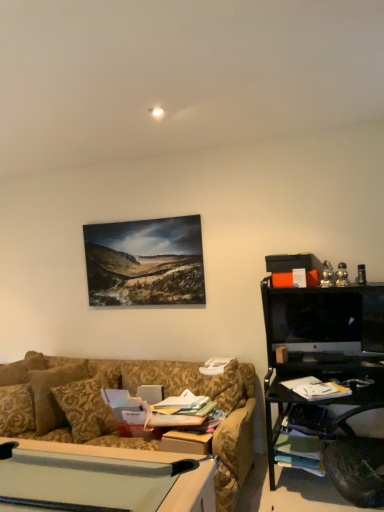
Describe the element at coordinates (88, 406) in the screenshot. This screenshot has width=384, height=512. I see `gold damask pillow at center` at that location.

This screenshot has height=512, width=384. What are the coordinates of `gold damask pillow at center` in the screenshot? It's located at (88, 406).

Identify the location of black glossy monitor at right. This screenshot has width=384, height=512. (317, 322).

The height and width of the screenshot is (512, 384). What do you see at coordinates (317, 322) in the screenshot?
I see `black glossy monitor at right` at bounding box center [317, 322].

Measure the distance between point (299, 296) and camera.

A distance of 3.17 meters exists between point (299, 296) and camera.

Identify the location of gold damask pillow at center. (88, 406).

Consider the image. Considering the relative positions of gold damask pillow at center and black glossy monitor at right in the image provided, is gold damask pillow at center to the left of black glossy monitor at right from the viewer's perspective?

Indeed, gold damask pillow at center is positioned on the left side of black glossy monitor at right.

In the image, is gold damask pillow at center positioned in front of or behind black glossy monitor at right?

Clearly, gold damask pillow at center is in front of black glossy monitor at right.

Considering the points (112, 378) and (289, 341), which point is in front, point (112, 378) or point (289, 341)?

The point (289, 341) is closer.

From the image's perspective, is gold damask pillow at center on black glossy monitor at right?

Actually, gold damask pillow at center appears below black glossy monitor at right in the image.

From a real-world perspective, between gold damask pillow at center and black glossy monitor at right, who is vertically higher?

black glossy monitor at right.

Can you confirm if gold damask pillow at center is wider than black glossy monitor at right?

Yes.

Does gold damask pillow at center have a lesser height compared to black glossy monitor at right?

No.

In terms of size, does gold damask pillow at center appear bigger or smaller than black glossy monitor at right?

Considering their sizes, gold damask pillow at center takes up more space than black glossy monitor at right.

Is gold damask pillow at center outside of black glossy monitor at right?

gold damask pillow at center is positioned outside black glossy monitor at right.

Is gold damask pillow at center positioned far away from black glossy monitor at right?

Yes.

Is gold damask pillow at center aimed at black glossy monitor at right?

No, gold damask pillow at center is not aimed at black glossy monitor at right.

How many degrees apart are the facing directions of gold damask pillow at center and black glossy monitor at right?

The angular difference between gold damask pillow at center and black glossy monitor at right is 60.4 degrees.

Measure the distance between gold damask pillow at center and black glossy monitor at right.

gold damask pillow at center and black glossy monitor at right are 5.02 feet apart.

Where is `computer monitor behind the gold damask pillow at center`? This screenshot has width=384, height=512. computer monitor behind the gold damask pillow at center is located at coordinates click(x=317, y=322).

Which is more to the right, black glossy monitor at right or gold damask pillow at center?

Positioned to the right is black glossy monitor at right.

Is black glossy monitor at right behind gold damask pillow at center?

Answer: Yes.

Which point is more forward, (321, 313) or (114, 382)?

The point (321, 313) is more forward.

From the image's perspective, which is below, black glossy monitor at right or gold damask pillow at center?

gold damask pillow at center is shown below in the image.

From a real-world perspective, is black glossy monitor at right under gold damask pillow at center?

Incorrect, from a real-world perspective, black glossy monitor at right is higher than gold damask pillow at center.

Considering the sizes of objects black glossy monitor at right and gold damask pillow at center in the image provided, who is wider, black glossy monitor at right or gold damask pillow at center?

gold damask pillow at center is wider.

Is black glossy monitor at right shorter than gold damask pillow at center?

Yes.

Between black glossy monitor at right and gold damask pillow at center, which one has larger size?

Bigger between the two is gold damask pillow at center.

Is black glossy monitor at right spatially inside gold damask pillow at center, or outside of it?

black glossy monitor at right is outside gold damask pillow at center.

Is black glossy monitor at right beside gold damask pillow at center?

They are not placed beside each other.

Is black glossy monitor at right positioned with its back to gold damask pillow at center?

No, black glossy monitor at right is not facing away from gold damask pillow at center.

Measure the distance between black glossy monitor at right and gold damask pillow at center.

black glossy monitor at right is 5.02 feet away from gold damask pillow at center.

In the image, there is a gold damask pillow at center. Identify the location of computer monitor above it (from the image's perspective). The height and width of the screenshot is (512, 384). (317, 322).

Identify the location of pillow that appears on the left of black glossy monitor at right. (88, 406).

I want to click on pillow that appears in front of the black glossy monitor at right, so click(x=88, y=406).